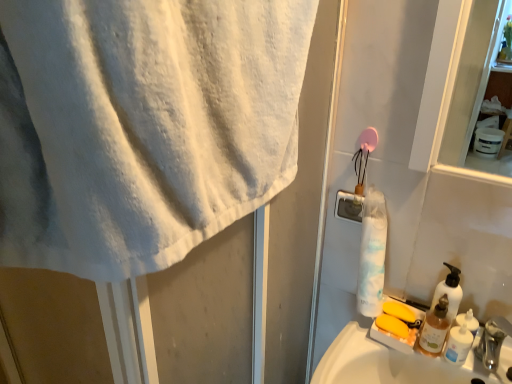
Question: Is white matte shaving cream at lower right facing towards white matte soap dispenser at right?

Choices:
 (A) yes
 (B) no

Answer: (B)

Question: Is white matte shaving cream at lower right oriented away from white matte soap dispenser at right?

Choices:
 (A) yes
 (B) no

Answer: (B)

Question: Would you say white matte shaving cream at lower right is outside white matte soap dispenser at right?

Choices:
 (A) no
 (B) yes

Answer: (B)

Question: From the image's perspective, is white matte shaving cream at lower right over white matte soap dispenser at right?

Choices:
 (A) yes
 (B) no

Answer: (B)

Question: Is white matte shaving cream at lower right bigger than white matte soap dispenser at right?

Choices:
 (A) no
 (B) yes

Answer: (A)

Question: Is point (450, 281) positioned closer to the camera than point (484, 324)?

Choices:
 (A) closer
 (B) farther

Answer: (A)

Question: Would you say white matte soap dispenser at right is to the left or to the right of silver metallic faucet at lower right in the picture?

Choices:
 (A) right
 (B) left

Answer: (B)

Question: Based on their sizes in the image, would you say white matte soap dispenser at right is bigger or smaller than silver metallic faucet at lower right?

Choices:
 (A) small
 (B) big

Answer: (A)

Question: From a real-world perspective, is white matte soap dispenser at right physically located above or below silver metallic faucet at lower right?

Choices:
 (A) below
 (B) above

Answer: (B)

Question: From a real-world perspective, is white matte soap dispenser at right above or below translucent plastic soap dispenser at right?

Choices:
 (A) above
 (B) below

Answer: (A)

Question: Considering their positions, is white matte soap dispenser at right located in front of or behind translucent plastic soap dispenser at right?

Choices:
 (A) front
 (B) behind

Answer: (B)

Question: Is white matte soap dispenser at right inside or outside of translucent plastic soap dispenser at right?

Choices:
 (A) outside
 (B) inside

Answer: (A)

Question: In terms of height, does white matte soap dispenser at right look taller or shorter compared to translucent plastic soap dispenser at right?

Choices:
 (A) tall
 (B) short

Answer: (A)

Question: Relative to white matte shaving cream at lower right, is translucent plastic soap dispenser at right in front or behind?

Choices:
 (A) front
 (B) behind

Answer: (A)

Question: From their relative heights in the image, would you say translucent plastic soap dispenser at right is taller or shorter than white matte shaving cream at lower right?

Choices:
 (A) tall
 (B) short

Answer: (A)